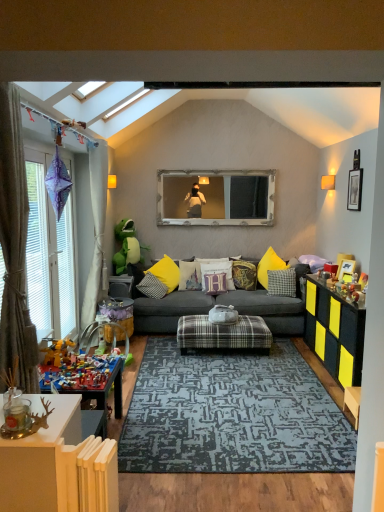
What do you see at coordinates (346, 268) in the screenshot? I see `wooden picture frame at right, the 2th picture frame in the top-to-bottom sequence` at bounding box center [346, 268].

Measure the distance between point (113, 308) and camera.

4.70 meters.

Describe the element at coordinates (215, 283) in the screenshot. I see `plush yellow pillow at center, which is counted as the fourth pillow, starting from the right` at that location.

Measure the distance between point (201, 342) and camera.

4.35 meters.

What are the coordinates of `multicolored plastic toys at lower left` in the screenshot? It's located at (77, 370).

At what (x,y) coordinates should I click in order to perform the action: click on brown fabric curtain at left, which ranks as the 1th curtain in front-to-back order. Please return your answer as a coordinate pair (x, y). Looking at the image, I should click on (15, 248).

Does point (80, 386) come farther from viewer compared to point (161, 295)?

That is False.

Could you tell me if multicolored plastic toys at lower left is turned towards yellow fabric pillow at center, which ranks as the 1th pillow in left-to-right order?

No, multicolored plastic toys at lower left does not turn towards yellow fabric pillow at center, which ranks as the 1th pillow in left-to-right order.

Based on the photo, considering the sizes of objects multicolored plastic toys at lower left and yellow fabric pillow at center, which ranks as the 1th pillow in left-to-right order, in the image provided, who is wider, multicolored plastic toys at lower left or yellow fabric pillow at center, which ranks as the 1th pillow in left-to-right order,?

yellow fabric pillow at center, which ranks as the 1th pillow in left-to-right order, is wider.

Is the surface of yellow plastic toy at lower left, which appears as the second toy when viewed from the top, in direct contact with white wooden frame at center?

They are not placed beside each other.

From the image's perspective, which object appears higher, yellow plastic toy at lower left, placed as the first toy when sorted from front to back, or white wooden frame at center?

white wooden frame at center, from the image's perspective.

Where is `window screen behind the yellow plastic toy at lower left, placed as the 1th toy when sorted from bottom to top`? This screenshot has width=384, height=512. window screen behind the yellow plastic toy at lower left, placed as the 1th toy when sorted from bottom to top is located at coordinates (215, 197).

Considering the sizes of wooden picture frame at upper right, positioned as the 2th picture frame in bottom-to-top order, and multicolored plastic toys at lower left in the image, is wooden picture frame at upper right, positioned as the 2th picture frame in bottom-to-top order, wider or thinner than multicolored plastic toys at lower left?

Considering their sizes, wooden picture frame at upper right, positioned as the 2th picture frame in bottom-to-top order, looks slimmer than multicolored plastic toys at lower left.

From a real-world perspective, between wooden picture frame at upper right, marked as the first picture frame in a right-to-left arrangement, and multicolored plastic toys at lower left, who is vertically higher?

wooden picture frame at upper right, marked as the first picture frame in a right-to-left arrangement.

Based on the photo, from the image's perspective, who appears lower, wooden picture frame at upper right, marked as the first picture frame in a right-to-left arrangement, or multicolored plastic toys at lower left?

multicolored plastic toys at lower left, from the image's perspective.

Which is correct: wooden picture frame at upper right, marked as the first picture frame in a right-to-left arrangement, is inside yellow fabric pillow at center, acting as the 6th pillow starting from the right, or outside of it?

wooden picture frame at upper right, marked as the first picture frame in a right-to-left arrangement, is outside yellow fabric pillow at center, acting as the 6th pillow starting from the right.

From the image's perspective, is wooden picture frame at upper right, positioned as the 2th picture frame in bottom-to-top order, below yellow fabric pillow at center, acting as the 6th pillow starting from the right?

No.

Looking at this image, are wooden picture frame at upper right, which appears as the 2th picture frame when viewed from the left, and yellow fabric pillow at center, which ranks as the 1th pillow in left-to-right order, far apart?

wooden picture frame at upper right, which appears as the 2th picture frame when viewed from the left, is far away from yellow fabric pillow at center, which ranks as the 1th pillow in left-to-right order.

What's the angular difference between wooden picture frame at upper right, positioned as the 2th picture frame in bottom-to-top order, and yellow fabric pillow at center, which ranks as the 1th pillow in left-to-right order,'s facing directions?

wooden picture frame at upper right, positioned as the 2th picture frame in bottom-to-top order, and yellow fabric pillow at center, which ranks as the 1th pillow in left-to-right order, are facing 150 degrees away from each other.

Does point (182, 285) lie in front of point (221, 263)?

Yes, it is in front of point (221, 263).

Is printed fabric pillow at center, which ranks as the second pillow in left-to-right order, far away from white fabric pillow at center, which is the fourth pillow from left to right?

printed fabric pillow at center, which ranks as the second pillow in left-to-right order, is actually quite close to white fabric pillow at center, which is the fourth pillow from left to right.

From a real-world perspective, who is located higher, printed fabric pillow at center, positioned as the 5th pillow in right-to-left order, or white fabric pillow at center, which is the fourth pillow from left to right?

printed fabric pillow at center, positioned as the 5th pillow in right-to-left order, is physically above.

From the image's perspective, does printed fabric pillow at center, positioned as the 5th pillow in right-to-left order, appear higher than white fabric pillow at center, which is the third pillow from right to left?

Yes, from the image's perspective, printed fabric pillow at center, positioned as the 5th pillow in right-to-left order, is on top of white fabric pillow at center, which is the third pillow from right to left.

From the image's perspective, between yellow fabric pillow at center, which ranks as the 1th pillow in left-to-right order, and white fabric curtain at left, positioned as the 1th curtain in back-to-front order, which one is located above?

white fabric curtain at left, positioned as the 1th curtain in back-to-front order, is shown above in the image.

Image resolution: width=384 pixels, height=512 pixels. I want to click on the 1st curtain directly above the yellow fabric pillow at center, which ranks as the 1th pillow in left-to-right order (from a real-world perspective), so click(x=96, y=228).

Which of these two, yellow fabric pillow at center, acting as the 6th pillow starting from the right, or white fabric curtain at left, positioned as the 1th curtain in back-to-front order, stands shorter?

Standing shorter between the two is yellow fabric pillow at center, acting as the 6th pillow starting from the right.

Who is bigger, brown fabric curtain at left, the second curtain in the back-to-front sequence, or velvet gold pillow at center, the second pillow in the right-to-left sequence?

Bigger between the two is brown fabric curtain at left, the second curtain in the back-to-front sequence.

Would you say brown fabric curtain at left, which ranks as the 1th curtain in front-to-back order, is inside or outside velvet gold pillow at center, the second pillow in the right-to-left sequence?

brown fabric curtain at left, which ranks as the 1th curtain in front-to-back order, is located beyond the bounds of velvet gold pillow at center, the second pillow in the right-to-left sequence.

From the image's perspective, is brown fabric curtain at left, which ranks as the 1th curtain in front-to-back order, over velvet gold pillow at center, marked as the 5th pillow in a left-to-right arrangement?

Yes, from the image's perspective, brown fabric curtain at left, which ranks as the 1th curtain in front-to-back order, is on top of velvet gold pillow at center, marked as the 5th pillow in a left-to-right arrangement.

From a real-world perspective, is brown fabric curtain at left, which ranks as the 1th curtain in front-to-back order, located beneath velvet gold pillow at center, the second pillow in the right-to-left sequence?

No, from a real-world perspective, brown fabric curtain at left, which ranks as the 1th curtain in front-to-back order, is not beneath velvet gold pillow at center, the second pillow in the right-to-left sequence.

From the image's perspective, starting from the multicolored plastic toys at lower left, which pillow is the 1st one above? Please provide its 2D coordinates.

[(152, 286)]

Where is `window screen behind the yellow plastic toy at lower left, placed as the 1th toy when sorted from bottom to top`? The height and width of the screenshot is (512, 384). window screen behind the yellow plastic toy at lower left, placed as the 1th toy when sorted from bottom to top is located at coordinates (215, 197).

When comparing their distances from translucent plastic toy at left, the 1th table in the left-to-right sequence, does yellow fabric pillow at center, acting as the 6th pillow starting from the right, or dark gray fabric couch at center seem further?

dark gray fabric couch at center.

Based on their spatial positions, is velvet gold pillow at center, marked as the 5th pillow in a left-to-right arrangement, or yellow fabric pillow at center, acting as the 6th pillow starting from the right, closer to plush yellow pillow at center, the 3th pillow from the left?

velvet gold pillow at center, marked as the 5th pillow in a left-to-right arrangement.

Based on their spatial positions, is white fabric curtain at left, the second curtain from the front, or velvet gold pillow at center, marked as the 5th pillow in a left-to-right arrangement, closer to black textured dresser at right?

The object closer to black textured dresser at right is velvet gold pillow at center, marked as the 5th pillow in a left-to-right arrangement.

Considering their positions, is dark gray fabric couch at center positioned further to brown fabric curtain at left, which ranks as the 1th curtain in front-to-back order, than white fabric curtain at left, the second curtain from the front?

dark gray fabric couch at center is further to brown fabric curtain at left, which ranks as the 1th curtain in front-to-back order.

From the image, which object appears to be nearer to multicolored plastic toys at lower left, brown fabric curtain at left, which ranks as the 1th curtain in front-to-back order, or black textured dresser at right?

Among the two, brown fabric curtain at left, which ranks as the 1th curtain in front-to-back order, is located nearer to multicolored plastic toys at lower left.

Considering their positions, is white wooden frame at center positioned further to white fabric pillow at center, which is the fourth pillow from left to right, than brown fabric curtain at left, which ranks as the 1th curtain in front-to-back order?

brown fabric curtain at left, which ranks as the 1th curtain in front-to-back order, lies further to white fabric pillow at center, which is the fourth pillow from left to right, than the other object.

From the image, which object appears to be nearer to wooden picture frame at upper right, positioned as the 2th picture frame in bottom-to-top order, white fabric pillow at center, which is the fourth pillow from left to right, or yellow fabric pillow at center, acting as the 6th pillow starting from the right?

Based on the image, white fabric pillow at center, which is the fourth pillow from left to right, appears to be nearer to wooden picture frame at upper right, positioned as the 2th picture frame in bottom-to-top order.

When comparing their distances from velvet gold pillow at center, the second pillow in the right-to-left sequence, does white textured paper at left or dark gray fabric couch at center seem closer?

dark gray fabric couch at center is closer to velvet gold pillow at center, the second pillow in the right-to-left sequence.

The height and width of the screenshot is (512, 384). I want to click on studio couch positioned between white textured paper at left and yellow fabric pillow at center, which ranks as the 1th pillow in left-to-right order, from near to far, so click(x=220, y=303).

Where is `dresser situated between multicolored plastic toys at lower left and wooden picture frame at upper right, marked as the first picture frame in a right-to-left arrangement, from left to right`? The image size is (384, 512). dresser situated between multicolored plastic toys at lower left and wooden picture frame at upper right, marked as the first picture frame in a right-to-left arrangement, from left to right is located at coordinates (335, 332).

This screenshot has width=384, height=512. What are the coordinates of `toy between white textured paper at left and white wooden frame at center in the front-back direction` in the screenshot? It's located at (127, 246).

Locate an element on the screen. This screenshot has width=384, height=512. stuff between yellow plastic toy at lower left, placed as the 1th toy when sorted from bottom to top, and wooden picture frame at upper right, acting as the first picture frame starting from the top, from left to right is located at coordinates (77, 370).